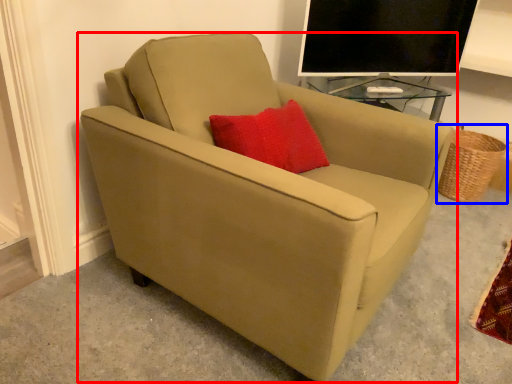
Question: Which object appears closest to the camera in this image, chair (highlighted by a red box) or basket (highlighted by a blue box)?

Choices:
 (A) chair
 (B) basket

Answer: (A)